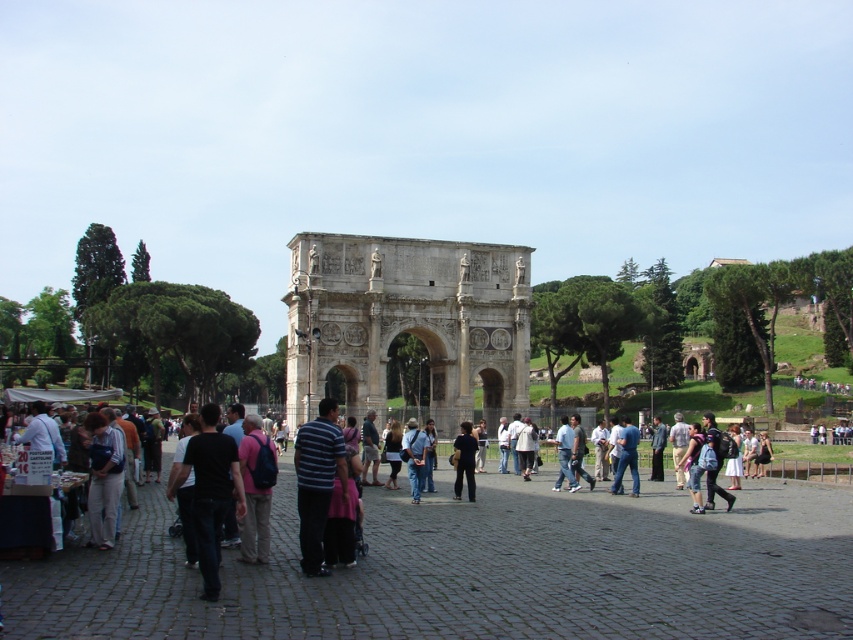
Which is above, light beige stone arch at center or dark blue fabric shirt at center?

light beige stone arch at center

Is light beige stone arch at center above dark blue fabric shirt at center?

Yes.

What do you see at coordinates (407, 321) in the screenshot? I see `light beige stone arch at center` at bounding box center [407, 321].

The image size is (853, 640). What are the coordinates of `light beige stone arch at center` in the screenshot? It's located at (407, 321).

Does light beige stone arch at center have a lesser width compared to blue jeans at center?

No.

What do you see at coordinates (407, 321) in the screenshot? The height and width of the screenshot is (640, 853). I see `light beige stone arch at center` at bounding box center [407, 321].

Identify the location of light beige stone arch at center. The image size is (853, 640). (407, 321).

Does blue jeans at center have a smaller size compared to dark blue fabric shirt at center?

Actually, blue jeans at center might be larger than dark blue fabric shirt at center.

Who is more distant from viewer, (425,435) or (468,497)?

Point (425,435)

You are a GUI agent. You are given a task and a screenshot of the screen. Output one action in this format:
    pyautogui.click(x=<x>, y=<y>)
    Task: Click on the blue jeans at center
    This screenshot has height=640, width=853.
    Given the screenshot: What is the action you would take?
    pyautogui.click(x=415, y=458)